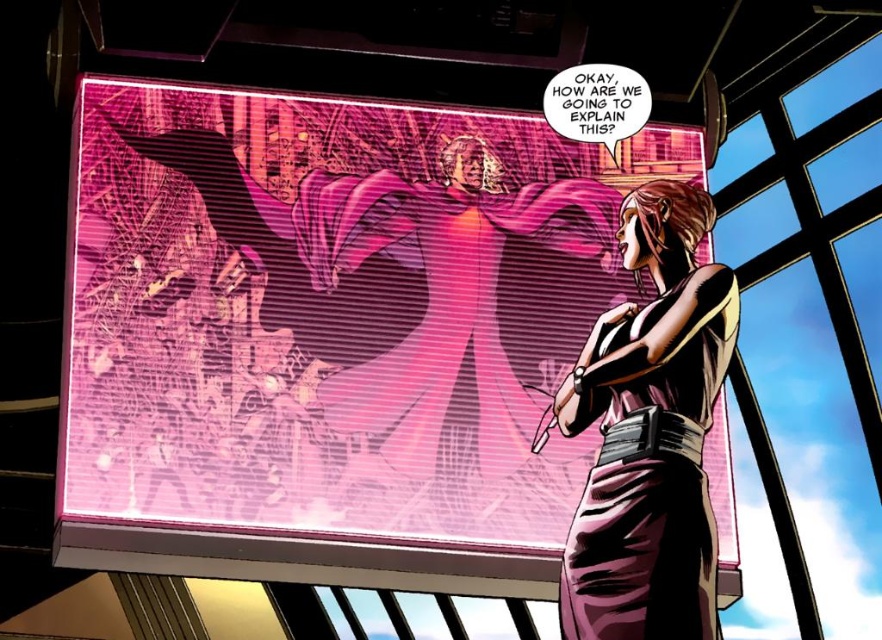
Find the location of a particular element. smooth purple pants at center is located at coordinates (331, 333).

Who is more distant from viewer, (407, 138) or (602, 524)?

The point (407, 138) is more distant.

Between point (534, 577) and point (623, 336), which one is positioned behind?

The point (534, 577) is behind.

Where is `smooth purple pants at center`? This screenshot has height=640, width=882. smooth purple pants at center is located at coordinates (331, 333).